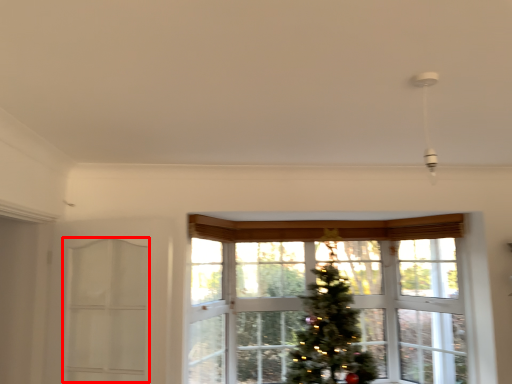
Question: From the image's perspective, where is screen door (annotated by the red box) located relative to window?

Choices:
 (A) above
 (B) below

Answer: (A)